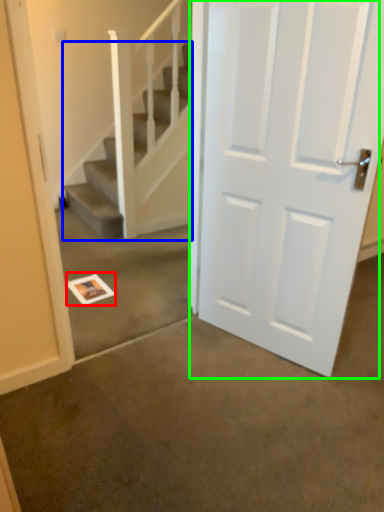
Question: Estimate the real-world distances between objects in this image. Which object is closer to postcard (highlighted by a red box), stairs (highlighted by a blue box) or door (highlighted by a green box)?

Choices:
 (A) stairs
 (B) door

Answer: (A)